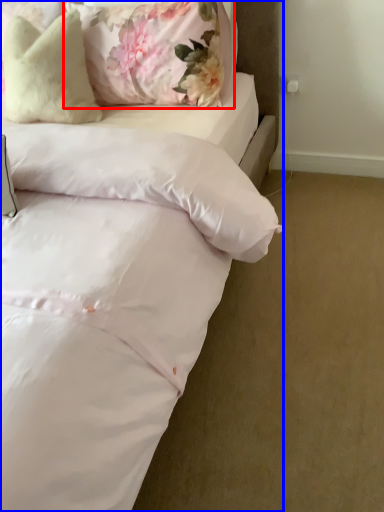
Question: Which object is closer to the camera taking this photo, pillow (highlighted by a red box) or bed (highlighted by a blue box)?

Choices:
 (A) pillow
 (B) bed

Answer: (B)